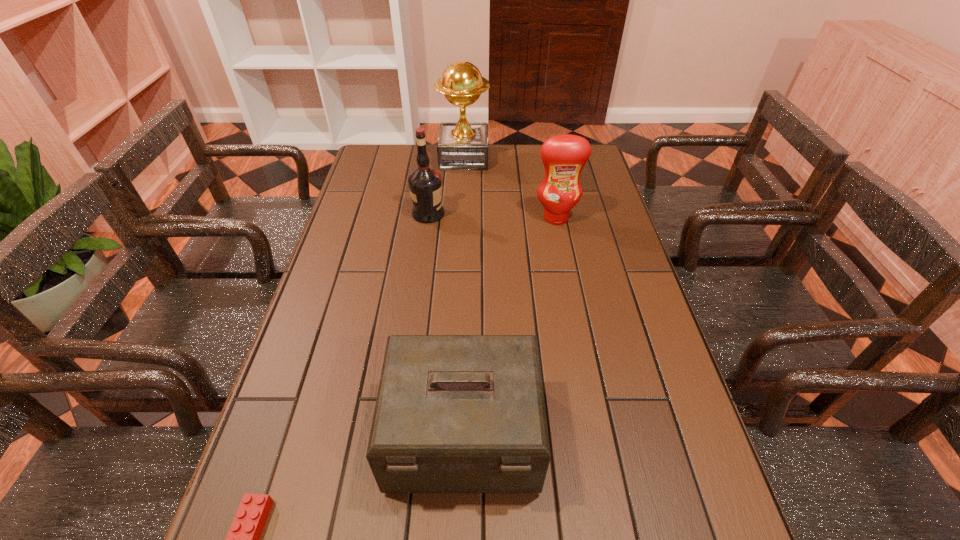
Locate an element on the screen. The width and height of the screenshot is (960, 540). the tallest object is located at coordinates (461, 146).

Locate an element on the screen. award is located at coordinates (461, 146).

The image size is (960, 540). Find the location of `liquor`. liquor is located at coordinates (425, 183).

Identify the location of the rightmost object. The image size is (960, 540). (564, 156).

Identify the location of the fourth tallest object. (454, 413).

Where is `vacant space located on the front-facing side of the tallest object`? The width and height of the screenshot is (960, 540). vacant space located on the front-facing side of the tallest object is located at coordinates [x=520, y=158].

Find the location of a particular element. free point located on the surface of the liquor is located at coordinates (564, 213).

Locate an element on the screen. free space located on the label side of the rightmost object is located at coordinates (560, 237).

Locate an element on the screen. Image resolution: width=960 pixels, height=540 pixels. free location located on the right of the second shortest object is located at coordinates (618, 435).

Find the location of `object that is at the far edge`. object that is at the far edge is located at coordinates (461, 146).